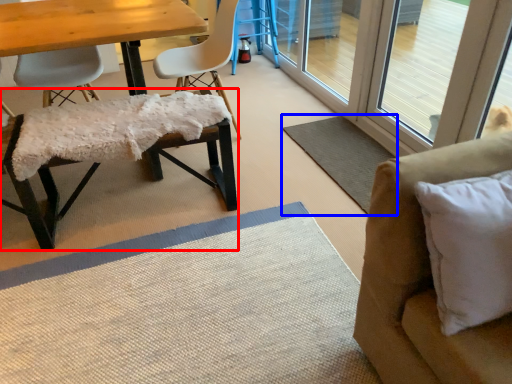
Question: Among these objects, which one is nearest to the camera, chair (highlighted by a red box) or mat (highlighted by a blue box)?

Choices:
 (A) chair
 (B) mat

Answer: (A)